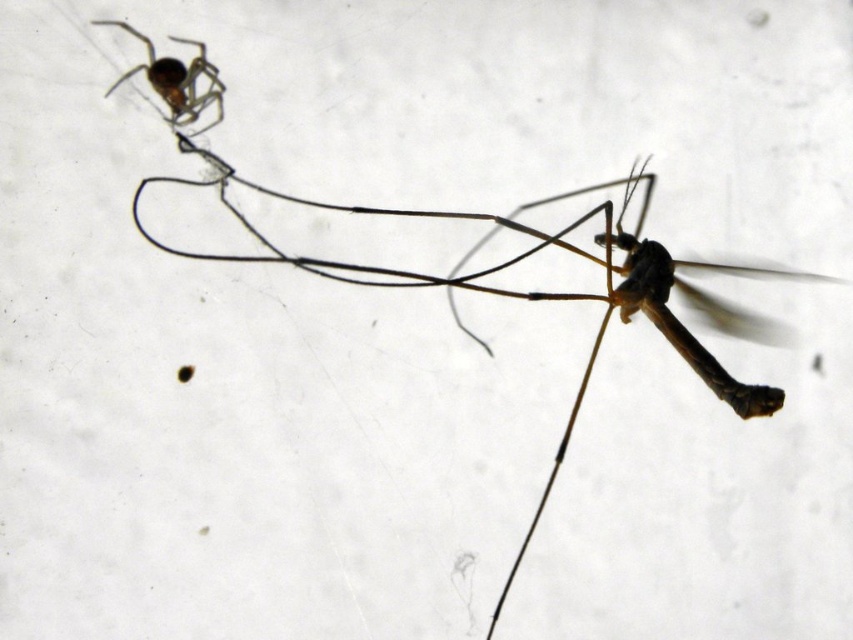
From the picture: Which of these two, matte black spider at upper left or shiny brown spider at upper left, stands shorter?

With less height is shiny brown spider at upper left.

Does matte black spider at upper left have a greater width compared to shiny brown spider at upper left?

Correct, the width of matte black spider at upper left exceeds that of shiny brown spider at upper left.

Is point (662, 285) farther from viewer compared to point (201, 93)?

Yes, it is behind point (201, 93).

The height and width of the screenshot is (640, 853). In order to click on matte black spider at upper left in this screenshot , I will do `click(548, 292)`.